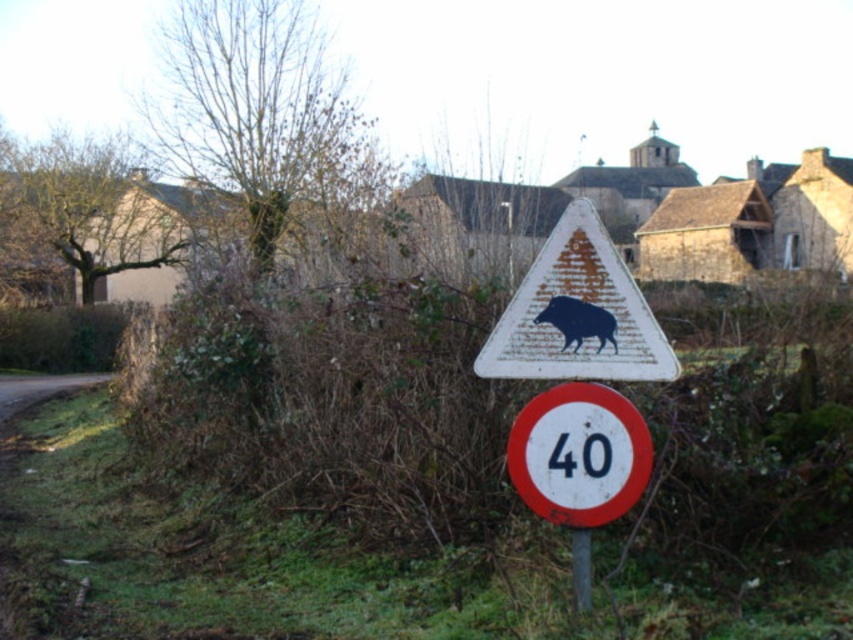
You are standing at the point marked by the coordinates point (x=578, y=321). Looking around, you see the dark matte boar at center. Which direction should you walk to reach the circular speed limit sign with a red border and a white center displaying the number 40 in black?

The point (x=578, y=321) is on the dark matte boar at center. To reach the circular speed limit sign with a red border and a white center displaying the number 40 in black, you should walk downward since the speed limit sign is below the boar sign.

You are driving on a rural road and see the dark matte boar at center and the metallic pole at center ahead. Which object should you look at first to determine the current speed limit?

The metallic pole at center is below the dark matte boar at center, so the speed limit sign on the metallic pole at center is positioned lower and closer to the road. Drivers should look at the metallic pole at center first to check the speed limit before noticing the wildlife warning sign above it.

You are a driver approaching the road sign and need to adjust your speed. You notice the dark matte boar at center and the metallic pole at center. Which object is wider in the image?

The dark matte boar at center is wider than the metallic pole at center according to the description.